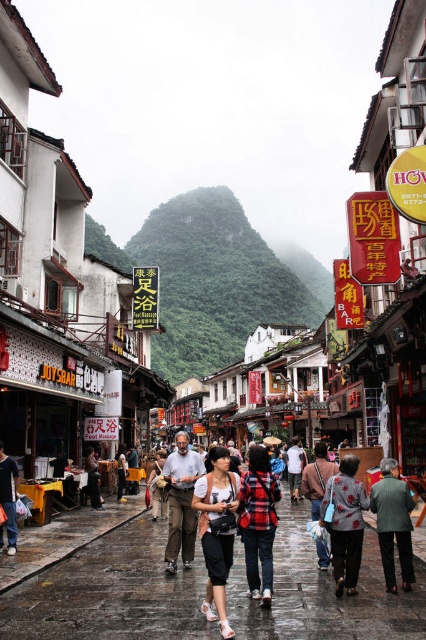
This screenshot has height=640, width=426. Describe the element at coordinates (207, 280) in the screenshot. I see `green textured mountain at center` at that location.

Measure the distance between green textured mountain at center and camera.

They are 82.09 meters apart.

You are a GUI agent. You are given a task and a screenshot of the screen. Output one action in this format:
    pyautogui.click(x=<x>, y=<y>)
    Task: Click on the green textured mountain at center
    The width and height of the screenshot is (426, 640).
    Given the screenshot: What is the action you would take?
    pyautogui.click(x=207, y=280)

Between point (319, 580) and point (302, 484), which one is positioned behind?

The point (302, 484) is behind.

Consider the image. Which is more to the right, matte black bag at center or matte black backpack at center?

matte black backpack at center is more to the right.

Which is in front, point (230, 577) or point (310, 509)?

Positioned in front is point (230, 577).

Find the location of a particular element. The width and height of the screenshot is (426, 640). matte black bag at center is located at coordinates (111, 593).

Does point (229, 531) come farther from viewer compared to point (327, 552)?

No, it is not.

Does matte black shirt at center appear under matte black backpack at center?

Incorrect, matte black shirt at center is not positioned below matte black backpack at center.

Who is more distant from viewer, (210,620) or (310,477)?

Point (310,477)

This screenshot has height=640, width=426. What are the coordinates of `matte black shirt at center` in the screenshot? It's located at (216, 531).